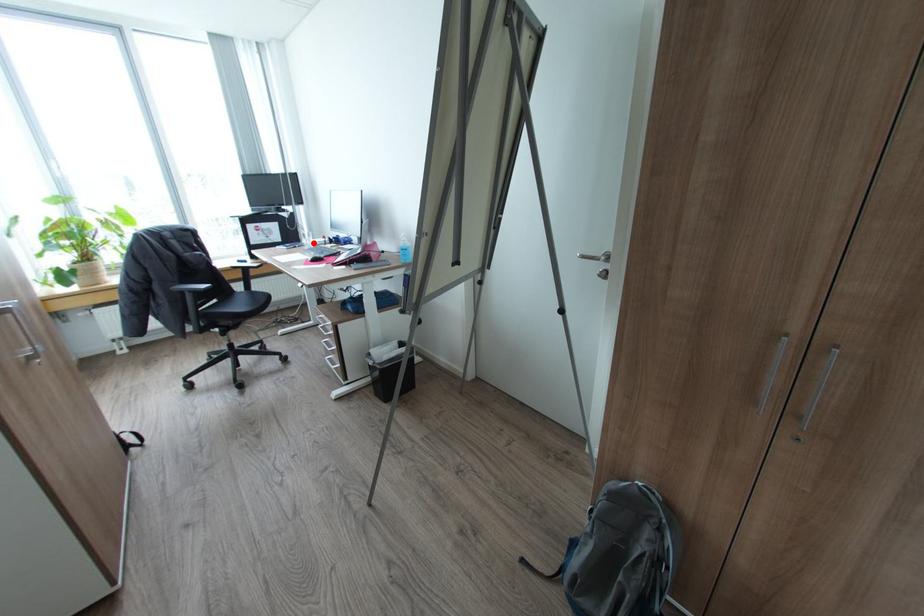
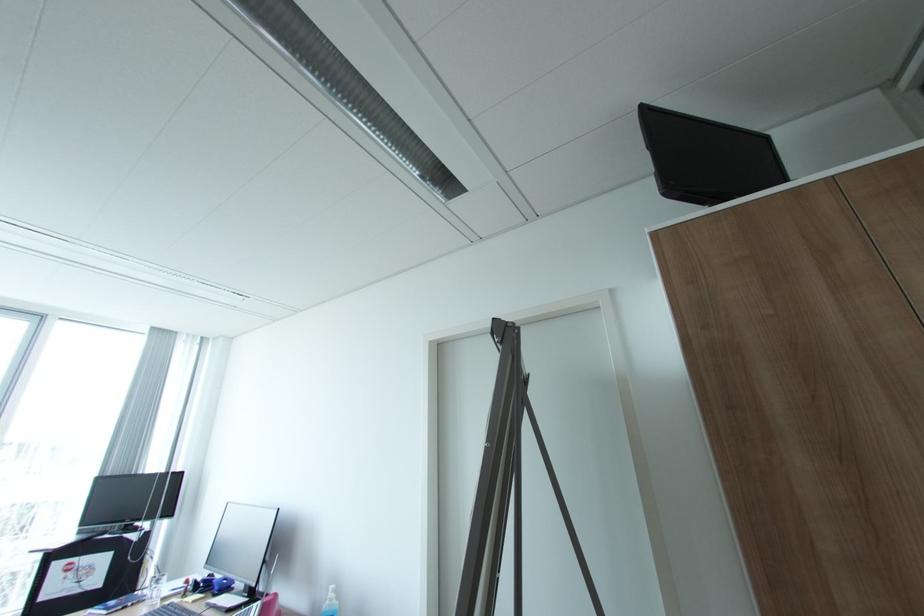
Question: I am providing you with two images of the same scene from different viewpoints. Given a red point in image1, look at the same physical point in image2. Is it:

Choices:
 (A) Closer to the viewpoint
 (B) Farther from the viewpoint

Answer: (A)